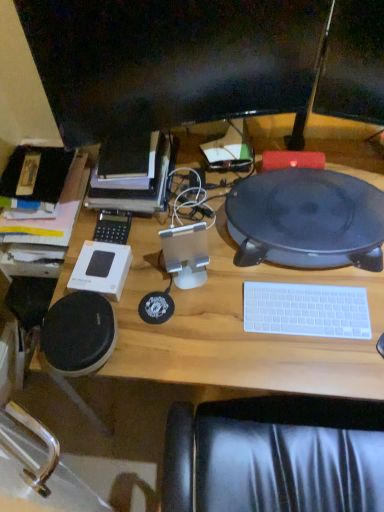
Locate an element on the screen. free space that is in between white plastic keyboard at lower right and matte black tablet at center is located at coordinates (294, 288).